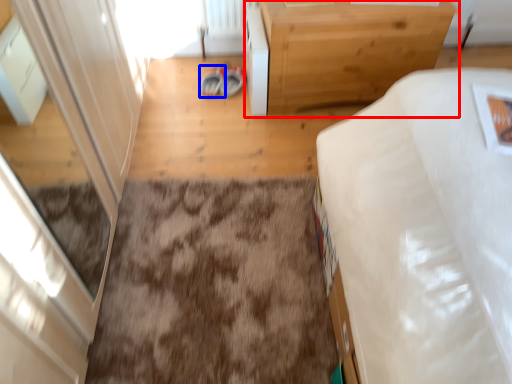
Question: Which object appears farthest to the camera in this image, table (highlighted by a red box) or footwear (highlighted by a blue box)?

Choices:
 (A) table
 (B) footwear

Answer: (B)